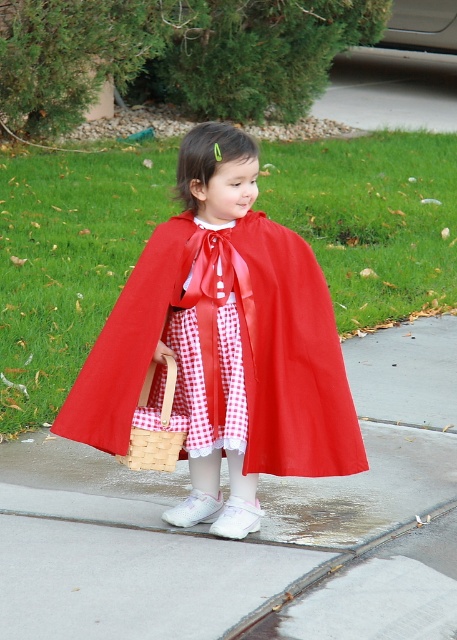
You are a delivery robot that needs to deliver a package to the red checkered fabric dress at center. The robot can only move on the smooth concrete pavement at center. What is the minimum distance the robot needs to travel to reach the dress?

The smooth concrete pavement at center is 3.66 feet away from red checkered fabric dress at center. Therefore, the minimum distance the robot needs to travel to reach the dress is 3.66 feet.

You are a delivery robot trying to place the woven wood basket at center on the smooth concrete pavement at center. Can you safely place the basket on the pavement without it overlapping?

The smooth concrete pavement at center is to the right of the woven wood basket at center, so you can move the basket to the right onto the pavement without overlapping.

You are a photographer setting up a shot of the child in the scene. The camera frame is already positioned to include both the red checkered fabric dress at center and the woven wood basket at center. To ensure the dress is fully visible, should you adjust the frame to the left or right?

The red checkered fabric dress at center might be wider than the woven wood basket at center, so you should adjust the frame to the right to accommodate the dress.